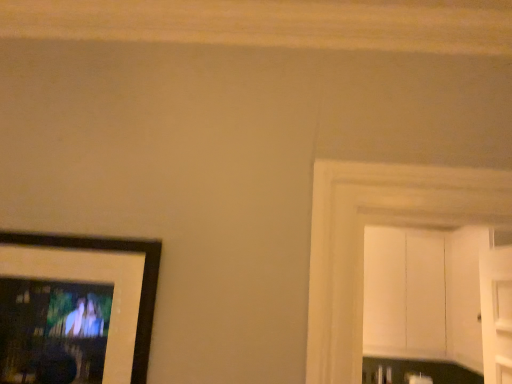
Locate an element on the screen. The image size is (512, 384). matte black picture frame at left is located at coordinates (112, 251).

What do you see at coordinates (112, 251) in the screenshot? The height and width of the screenshot is (384, 512). I see `matte black picture frame at left` at bounding box center [112, 251].

The image size is (512, 384). Identify the location of matte black picture frame at left. (112, 251).